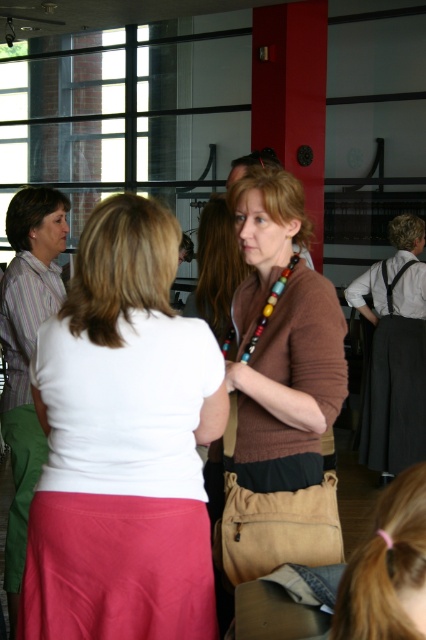
Question: Does white matte shirt at center appear over brown matte sweater at center?

Choices:
 (A) yes
 (B) no

Answer: (B)

Question: Does white matte shirt at center appear under brown matte sweater at center?

Choices:
 (A) yes
 (B) no

Answer: (A)

Question: Among these objects, which one is farthest from the camera?

Choices:
 (A) white matte shirt at center
 (B) brown matte sweater at center

Answer: (B)

Question: Which point is farther from the camera taking this photo?

Choices:
 (A) (137, 406)
 (B) (256, 212)

Answer: (B)

Question: Which of the following is the farthest from the observer?

Choices:
 (A) (108, 529)
 (B) (221, 516)

Answer: (B)

Question: Does white matte shirt at center have a smaller size compared to brown matte sweater at center?

Choices:
 (A) yes
 (B) no

Answer: (A)